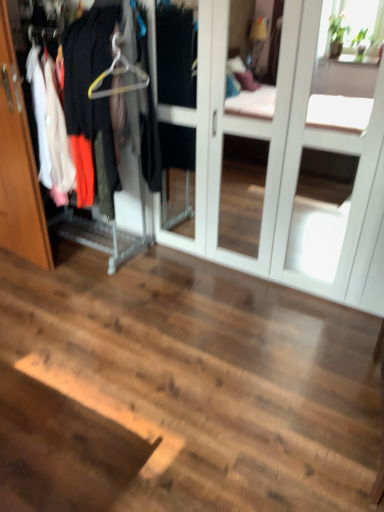
Image resolution: width=384 pixels, height=512 pixels. I want to click on free space above yellow plastic hanger at upper left (from a real-world perspective), so click(x=127, y=23).